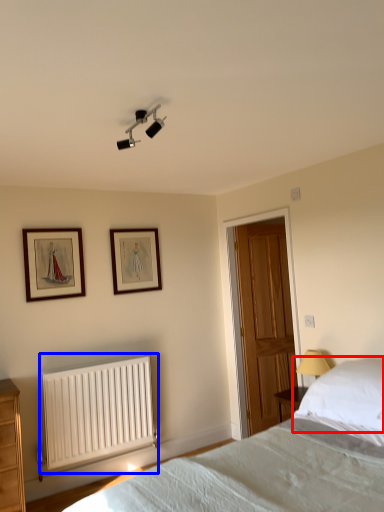
Question: Among these objects, which one is farthest to the camera, pillow (highlighted by a red box) or radiator (highlighted by a blue box)?

Choices:
 (A) pillow
 (B) radiator

Answer: (B)